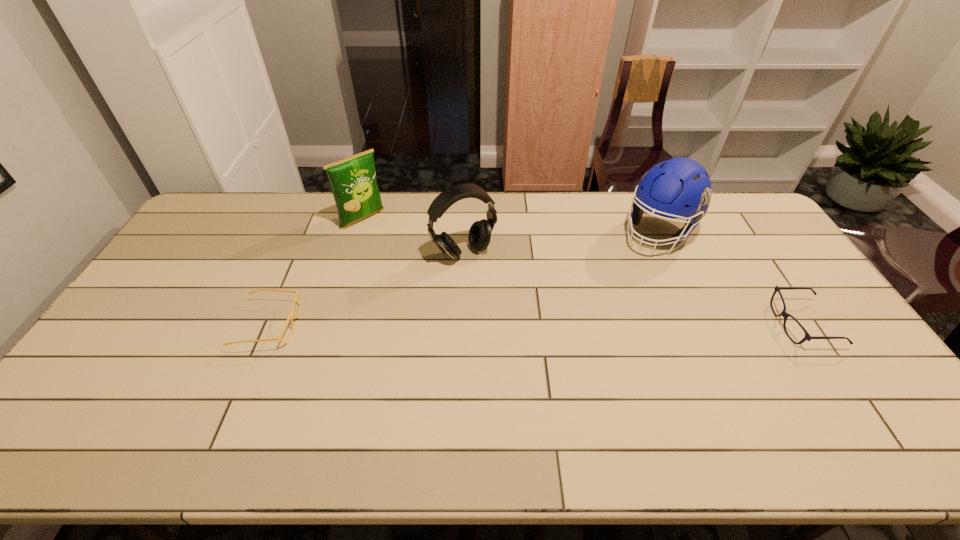
The width and height of the screenshot is (960, 540). Identify the location of object that is at the right edge. (807, 337).

At what (x,y) coordinates should I click in order to perform the action: click on free space at the far edge. Please return your answer as a coordinate pair (x, y). The image size is (960, 540). Looking at the image, I should click on (410, 213).

Find the location of a particular element. The image size is (960, 540). free space at the near edge is located at coordinates (388, 382).

Find the location of `free space at the right edge of the desktop`. free space at the right edge of the desktop is located at coordinates (801, 346).

You are a GUI agent. You are given a task and a screenshot of the screen. Output one action in this format:
    pyautogui.click(x=<x>, y=<y>)
    Task: Click on the vacant space at the far left corner of the desktop
    The height and width of the screenshot is (540, 960).
    Given the screenshot: What is the action you would take?
    pyautogui.click(x=250, y=200)

Locate an element on the screen. free region at the near left corner of the desktop is located at coordinates (77, 404).

The height and width of the screenshot is (540, 960). I want to click on free space at the near right corner, so click(834, 410).

This screenshot has height=540, width=960. I want to click on free spot between the right spectacles and the football helmet, so click(731, 279).

At what (x,y) coordinates should I click in order to perform the action: click on vacant space in between the left spectacles and the fourth object from left to right. Please return your answer as a coordinate pair (x, y). Image resolution: width=960 pixels, height=540 pixels. Looking at the image, I should click on (464, 279).

You are a GUI agent. You are given a task and a screenshot of the screen. Output one action in this format:
    pyautogui.click(x=<x>, y=<y>)
    Task: Click on the empty location between the second object from left to right and the right spectacles
    
    Given the screenshot: What is the action you would take?
    pyautogui.click(x=583, y=272)